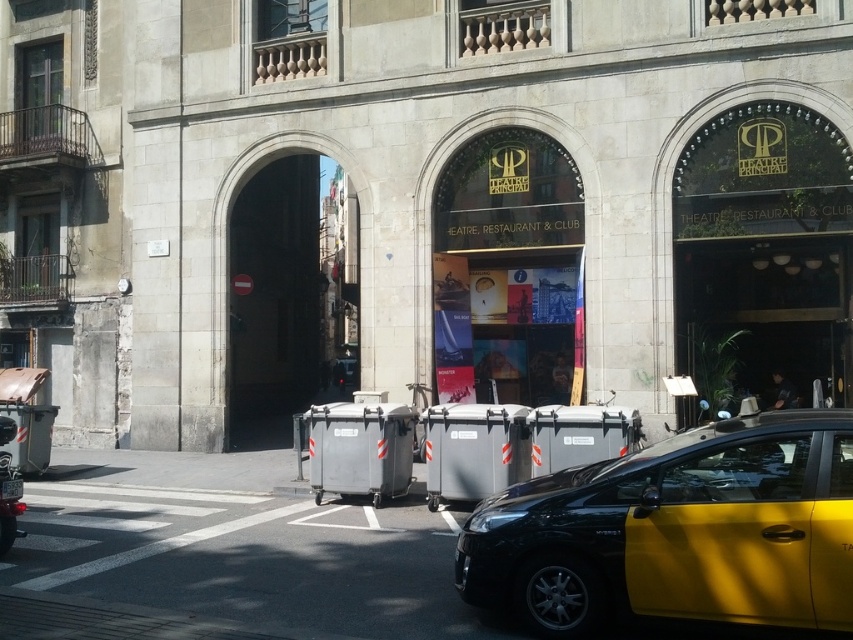
Does yellow matte taxi at lower right have a smaller size compared to white plastic license plate at lower center?

Incorrect, yellow matte taxi at lower right is not smaller in size than white plastic license plate at lower center.

Can you confirm if yellow matte taxi at lower right is positioned to the left of white plastic license plate at lower center?

Incorrect, yellow matte taxi at lower right is not on the left side of white plastic license plate at lower center.

You are a GUI agent. You are given a task and a screenshot of the screen. Output one action in this format:
    pyautogui.click(x=<x>, y=<y>)
    Task: Click on the yellow matte taxi at lower right
    The image size is (853, 640).
    Given the screenshot: What is the action you would take?
    pyautogui.click(x=677, y=531)

Between point (3, 492) and point (18, 481), which one is positioned in front?

Positioned in front is point (3, 492).

Which is more to the left, shiny chrome motorcycle at lower left or white plastic license plate at lower center?

From the viewer's perspective, shiny chrome motorcycle at lower left appears more on the left side.

Where is `shiny chrome motorcycle at lower left`? This screenshot has width=853, height=640. shiny chrome motorcycle at lower left is located at coordinates (9, 502).

Who is higher up, yellow matte taxi at lower right or shiny chrome motorcycle at lower left?

yellow matte taxi at lower right

Which is below, yellow matte taxi at lower right or shiny chrome motorcycle at lower left?

Positioned lower is shiny chrome motorcycle at lower left.

Does point (747, 474) lie behind point (10, 509)?

No, it is not.

The image size is (853, 640). I want to click on yellow matte taxi at lower right, so click(677, 531).